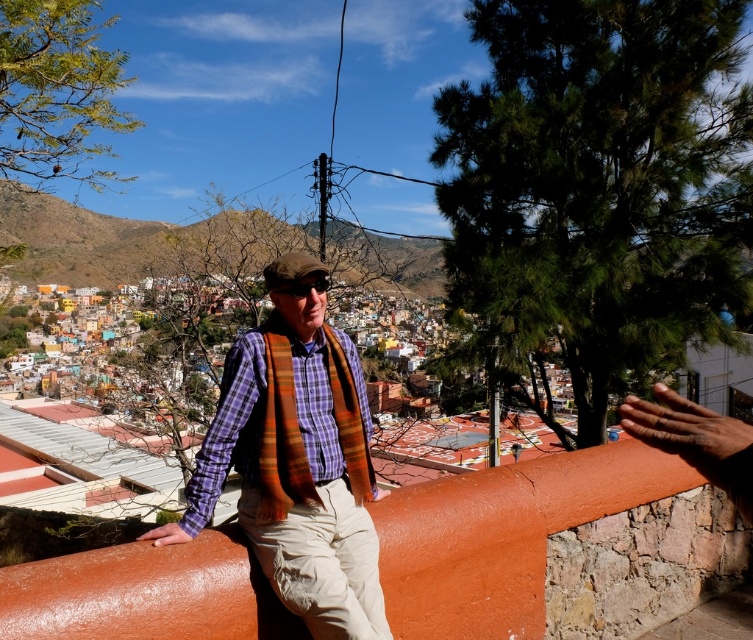
Does plaid fabric shirt at center appear on the left side of plaid cotton shirt at center?

No, plaid fabric shirt at center is not to the left of plaid cotton shirt at center.

Is plaid fabric shirt at center shorter than plaid cotton shirt at center?

Incorrect, plaid fabric shirt at center's height does not fall short of plaid cotton shirt at center's.

The height and width of the screenshot is (640, 753). Describe the element at coordinates (296, 460) in the screenshot. I see `plaid fabric shirt at center` at that location.

Where is `plaid fabric shirt at center`? This screenshot has width=753, height=640. plaid fabric shirt at center is located at coordinates (296, 460).

Is green grassy hillside at upper left shorter than orange rough stone wall at center?

Incorrect, green grassy hillside at upper left's height does not fall short of orange rough stone wall at center's.

Which is more to the left, green grassy hillside at upper left or orange rough stone wall at center?

green grassy hillside at upper left

This screenshot has width=753, height=640. Identify the location of green grassy hillside at upper left. click(84, 241).

The width and height of the screenshot is (753, 640). I want to click on green grassy hillside at upper left, so click(x=84, y=241).

Does plaid fabric shirt at center have a smaller size compared to orange rough stone wall at center?

No, plaid fabric shirt at center is not smaller than orange rough stone wall at center.

The height and width of the screenshot is (640, 753). Find the location of `plaid fabric shirt at center`. plaid fabric shirt at center is located at coordinates (296, 460).

Identify the location of plaid fabric shirt at center. (296, 460).